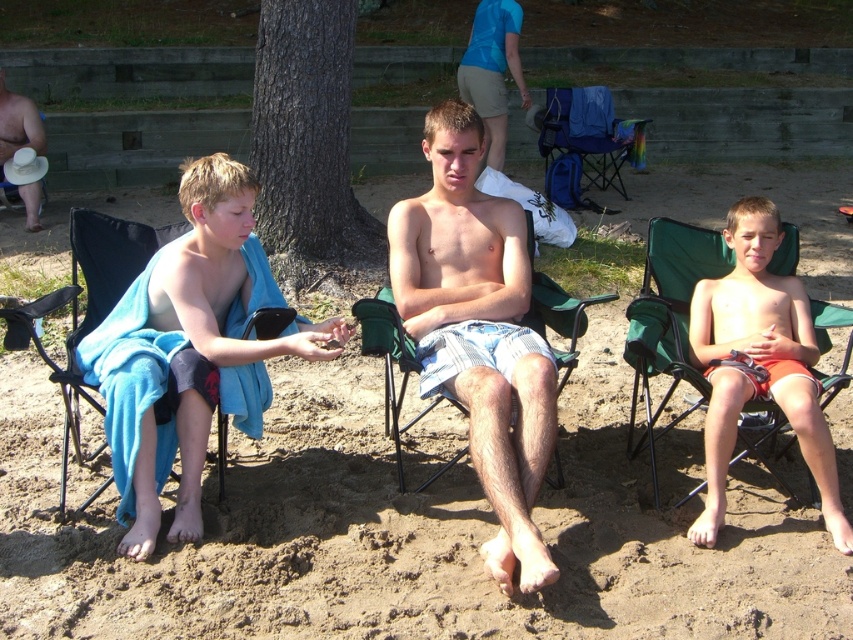
Is blue towel at left taller than orange cotton shorts at center?

Yes.

Who is lower down, blue towel at left or orange cotton shorts at center?

orange cotton shorts at center is below.

Which is behind, point (109, 394) or point (793, 358)?

Point (793, 358)

You are a GUI agent. You are given a task and a screenshot of the screen. Output one action in this format:
    pyautogui.click(x=<x>, y=<y>)
    Task: Click on the blue towel at left
    This screenshot has height=640, width=853.
    Given the screenshot: What is the action you would take?
    pyautogui.click(x=190, y=349)

Which is behind, point (726, 369) or point (389, 365)?

Point (389, 365)

Is orange cotton shorts at center behind green fabric beach chair at center?

No, it is not.

This screenshot has height=640, width=853. Identify the location of orange cotton shorts at center. (758, 364).

Can you confirm if smooth white skin at center is thinner than blue fabric beach chair at left?

In fact, smooth white skin at center might be wider than blue fabric beach chair at left.

Can you confirm if smooth white skin at center is bigger than blue fabric beach chair at left?

Indeed, smooth white skin at center has a larger size compared to blue fabric beach chair at left.

Who is more distant from viewer, (525, 294) or (86, 308)?

The point (86, 308) is behind.

In order to click on smooth white skin at center in this screenshot , I will do `click(479, 332)`.